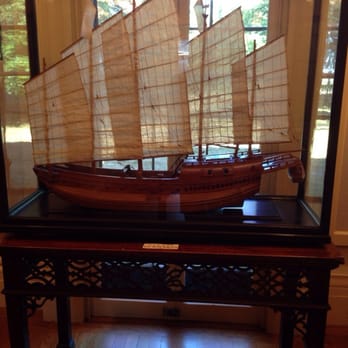
Locate an element on the screen. This screenshot has width=348, height=348. wooden table is located at coordinates (254, 283).